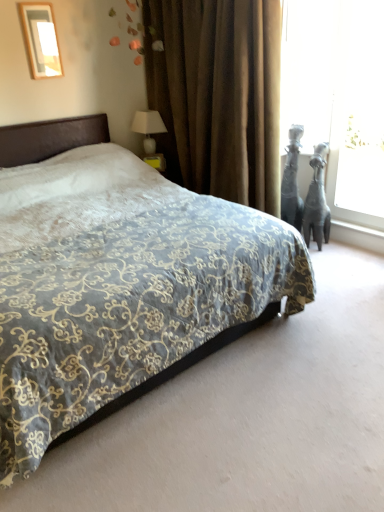
What is the approximate width of matte white picture frame at upper left?

It is 1.52 inches.

This screenshot has width=384, height=512. Describe the element at coordinates (292, 181) in the screenshot. I see `black glossy statue at right` at that location.

This screenshot has width=384, height=512. I want to click on white glossy wood at right, so click(357, 228).

Measure the distance between white glossy wood at right and camera.

white glossy wood at right and camera are 11.85 feet apart.

This screenshot has width=384, height=512. Identify the location of transparent glass window screen at right. (338, 97).

Is transparent glass window screen at right looking in the opposite direction of black glossy statue at right?

transparent glass window screen at right does not have its back to black glossy statue at right.

Considering the positions of objects transparent glass window screen at right and black glossy statue at right in the image provided, who is more to the left, transparent glass window screen at right or black glossy statue at right?

From the viewer's perspective, black glossy statue at right appears more on the left side.

Is transparent glass window screen at right closer to the viewer compared to black glossy statue at right?

That is True.

From the image's perspective, relative to black glossy statue at right, is transparent glass window screen at right above or below?

Based on their image positions, transparent glass window screen at right is located above black glossy statue at right.

Measure the distance from transparent glass window screen at right to brown velvet curtain at center.

The distance of transparent glass window screen at right from brown velvet curtain at center is 36.94 inches.

Which of these two, transparent glass window screen at right or brown velvet curtain at center, is wider?

With larger width is brown velvet curtain at center.

Can you confirm if transparent glass window screen at right is positioned to the right of brown velvet curtain at center?

Yes, transparent glass window screen at right is to the right of brown velvet curtain at center.

Is transparent glass window screen at right turned away from brown velvet curtain at center?

No, transparent glass window screen at right is not facing the opposite direction of brown velvet curtain at center.

Consider the image. Is white glossy wood at right touching matte black giraffe at right?

They are not placed beside each other.

Looking at their sizes, would you say white glossy wood at right is wider or thinner than matte black giraffe at right?

white glossy wood at right is thinner than matte black giraffe at right.

In the scene shown: Do you think white glossy wood at right is within matte black giraffe at right, or outside of it?

white glossy wood at right is not enclosed by matte black giraffe at right.

Considering the relative sizes of white glossy wood at right and matte black giraffe at right in the image provided, is white glossy wood at right smaller than matte black giraffe at right?

Yes.

Is white glossy table lamp at upper right touching velvet-patterned bed at center?

white glossy table lamp at upper right and velvet-patterned bed at center are not in contact.

Can you confirm if white glossy table lamp at upper right is thinner than velvet-patterned bed at center?

Correct, the width of white glossy table lamp at upper right is less than that of velvet-patterned bed at center.

From the image's perspective, would you say white glossy table lamp at upper right is positioned over velvet-patterned bed at center?

Correct, white glossy table lamp at upper right appears higher than velvet-patterned bed at center in the image.

The width and height of the screenshot is (384, 512). Find the location of `table lamp above the velvet-patterned bed at center (from a real-world perspective)`. table lamp above the velvet-patterned bed at center (from a real-world perspective) is located at coordinates (148, 128).

How different are the orientations of white glossy wood at right and brown velvet curtain at center in degrees?

They differ by 0.607 degrees in their facing directions.

Locate an element on the screen. This screenshot has height=512, width=384. window sill behind the brown velvet curtain at center is located at coordinates (357, 228).

Is brown velvet curtain at center surrounded by white glossy wood at right?

No, brown velvet curtain at center is not a part of white glossy wood at right.

Which object is more forward, white glossy wood at right or brown velvet curtain at center?

brown velvet curtain at center is in front.

Considering the sizes of brown velvet curtain at center and matte black giraffe at right in the image, is brown velvet curtain at center taller or shorter than matte black giraffe at right?

brown velvet curtain at center is taller than matte black giraffe at right.

From the image's perspective, is brown velvet curtain at center above matte black giraffe at right?

Indeed, from the image's perspective, brown velvet curtain at center is shown above matte black giraffe at right.

Is brown velvet curtain at center aimed at matte black giraffe at right?

No, brown velvet curtain at center is not facing towards matte black giraffe at right.

Would you say brown velvet curtain at center is outside matte black giraffe at right?

Yes, brown velvet curtain at center is outside of matte black giraffe at right.

Which of these two, velvet-patterned bed at center or white glossy wood at right, is smaller?

white glossy wood at right is smaller.

Considering their positions, is velvet-patterned bed at center located in front of or behind white glossy wood at right?

In the image, velvet-patterned bed at center appears in front of white glossy wood at right.

Can you tell me how much velvet-patterned bed at center and white glossy wood at right differ in facing direction?

There is a 90.6-degree angle between the facing directions of velvet-patterned bed at center and white glossy wood at right.

Measure the distance between velvet-patterned bed at center and white glossy wood at right.

velvet-patterned bed at center is 2.23 meters away from white glossy wood at right.

Locate an element on the screen. The width and height of the screenshot is (384, 512). sculpture lying behind the transparent glass window screen at right is located at coordinates (292, 181).

You are a GUI agent. You are given a task and a screenshot of the screen. Output one action in this format:
    pyautogui.click(x=<x>, y=<y>)
    Task: Click on the curtain lying above the transparent glass window screen at right (from the image's perspective)
    This screenshot has width=384, height=512.
    Given the screenshot: What is the action you would take?
    pyautogui.click(x=218, y=95)

When comparing their distances from velvet-patterned bed at center, does white glossy table lamp at upper right or white glossy wood at right seem closer?

white glossy table lamp at upper right.

Looking at the image, which one is located further to matte black giraffe at right, black glossy statue at right or white glossy wood at right?

Based on the image, white glossy wood at right appears to be further to matte black giraffe at right.

When comparing their distances from white glossy table lamp at upper right, does transparent glass window screen at right or white glossy wood at right seem closer?

Among the two, transparent glass window screen at right is located nearer to white glossy table lamp at upper right.

From the image, which object appears to be nearer to velvet-patterned bed at center, matte black giraffe at right or white glossy wood at right?

matte black giraffe at right is positioned closer to the anchor velvet-patterned bed at center.

When comparing their distances from white glossy table lamp at upper right, does matte white picture frame at upper left or transparent glass window screen at right seem further?

Among the two, transparent glass window screen at right is located further to white glossy table lamp at upper right.

Considering their positions, is white glossy wood at right positioned closer to brown velvet curtain at center than matte white picture frame at upper left?

matte white picture frame at upper left.

Based on their spatial positions, is matte black giraffe at right or black glossy statue at right further from matte white picture frame at upper left?

The object further to matte white picture frame at upper left is matte black giraffe at right.

Estimate the real-world distances between objects in this image. Which object is further from velvet-patterned bed at center, brown velvet curtain at center or transparent glass window screen at right?

transparent glass window screen at right is further to velvet-patterned bed at center.

At what (x,y) coordinates should I click in order to perform the action: click on bed between matte white picture frame at upper left and white glossy wood at right. Please return your answer as a coordinate pair (x, y). The image size is (384, 512). Looking at the image, I should click on (116, 278).

Where is `table lamp located between matte white picture frame at upper left and black glossy statue at right in the left-right direction`? This screenshot has height=512, width=384. table lamp located between matte white picture frame at upper left and black glossy statue at right in the left-right direction is located at coordinates (148, 128).

At what (x,y) coordinates should I click in order to perform the action: click on window screen located between matte white picture frame at upper left and white glossy wood at right in the left-right direction. Please return your answer as a coordinate pair (x, y). The height and width of the screenshot is (512, 384). Looking at the image, I should click on (338, 97).

What are the coordinates of `window screen located between velvet-patterned bed at center and matte black giraffe at right in the depth direction` in the screenshot? It's located at pyautogui.click(x=338, y=97).